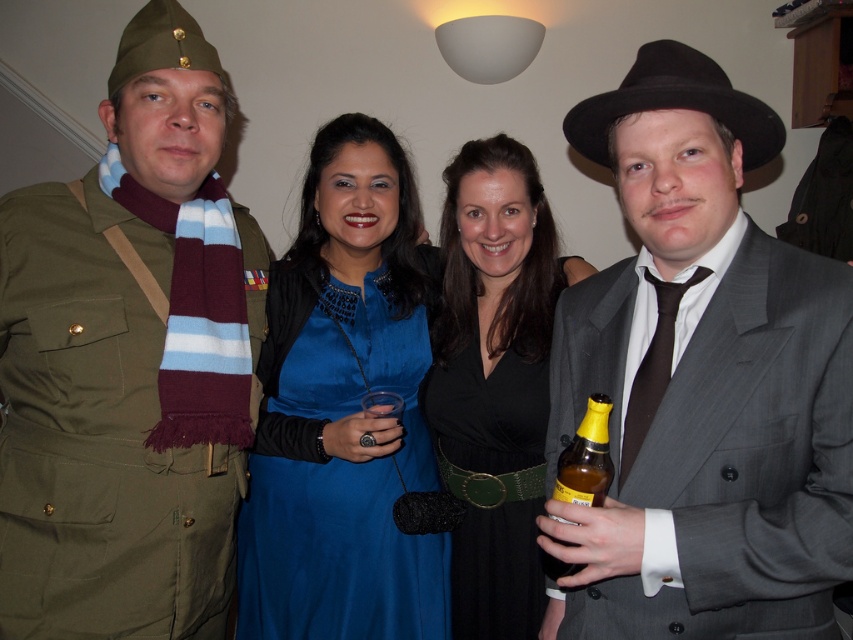
You are standing in the room and want to find the matte olive green uniform at left. According to the coordinates provided, where should you look relative to your position?

The matte olive green uniform at left is located at point coordinates (126, 362), which means it is positioned to the upper right from your perspective.

You are standing in the room and want to locate the matte olive green uniform at left. Which direction should you look to find it?

You should look to your left to find the matte olive green uniform at left.